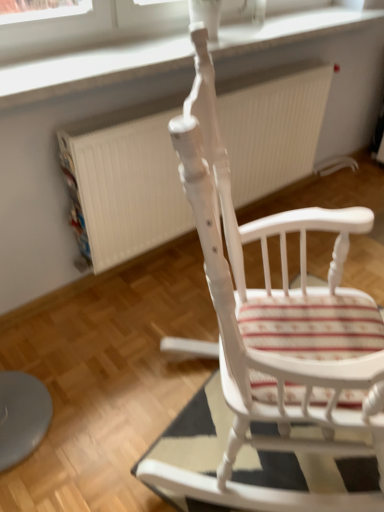
What is the approximate width of white plastic window frame at upper center?

It is 12.34 inches.

Locate an element on the screen. white plastic window frame at upper center is located at coordinates (90, 69).

Does white plastic window frame at upper center have a greater width compared to white textured radiator at center?

Indeed, white plastic window frame at upper center has a greater width compared to white textured radiator at center.

Which is less distant, (90,54) or (145,187)?

Point (90,54).

From the image's perspective, is white plastic window frame at upper center on top of white textured radiator at center?

Yes, from the image's perspective, white plastic window frame at upper center is over white textured radiator at center.

This screenshot has width=384, height=512. Find the location of `chair above the striped fabric mat at center (from a real-world perspective)`. chair above the striped fabric mat at center (from a real-world perspective) is located at coordinates (264, 298).

Is striped fabric mat at center taller or shorter than white painted wood rocking chair at center?

striped fabric mat at center is shorter than white painted wood rocking chair at center.

Which is more to the right, striped fabric mat at center or white painted wood rocking chair at center?

striped fabric mat at center.

Is striped fabric mat at center not close to white painted wood rocking chair at center?

No, striped fabric mat at center is in close proximity to white painted wood rocking chair at center.

Can we say white painted wood rocking chair at center lies outside striped fabric mat at center?

white painted wood rocking chair at center lies outside striped fabric mat at center's area.

From a real-world perspective, who is located lower, white painted wood rocking chair at center or striped fabric mat at center?

striped fabric mat at center is physically lower.

Which of these two, white painted wood rocking chair at center or striped fabric mat at center, stands shorter?

With less height is striped fabric mat at center.

Does point (197, 203) lie behind point (220, 409)?

No, (197, 203) is in front of (220, 409).

Relative to white painted wood rocking chair at center, is white textured radiator at center in front or behind?

In the image, white textured radiator at center appears behind white painted wood rocking chair at center.

In the image, there is a white painted wood rocking chair at center. Where is `radiator below it (from a real-world perspective)`? The width and height of the screenshot is (384, 512). radiator below it (from a real-world perspective) is located at coordinates (124, 184).

Is white painted wood rocking chair at center located within white textured radiator at center?

No, white textured radiator at center does not contain white painted wood rocking chair at center.

Which of these two, white textured radiator at center or white painted wood rocking chair at center, is smaller?

Smaller between the two is white textured radiator at center.

Between striped fabric mat at center and white plastic window frame at upper center, which one has larger width?

With larger width is striped fabric mat at center.

Is striped fabric mat at center aimed at white plastic window frame at upper center?

No, striped fabric mat at center is not oriented towards white plastic window frame at upper center.

Where is `window frame located behind the striped fabric mat at center`? This screenshot has height=512, width=384. window frame located behind the striped fabric mat at center is located at coordinates (90, 69).

From the image's perspective, between striped fabric mat at center and white textured radiator at center, who is located below?

From the image's view, striped fabric mat at center is below.

Which is closer to the camera, (204, 454) or (92, 248)?

Point (204, 454)

From the picture: How different are the orientations of striped fabric mat at center and white textured radiator at center in degrees?

The angular difference between striped fabric mat at center and white textured radiator at center is 16.9 degrees.

Are striped fabric mat at center and white textured radiator at center located far from each other?

They are positioned close to each other.

Based on the photo, can you confirm if white painted wood rocking chair at center is positioned to the right of white plastic window frame at upper center?

Indeed, white painted wood rocking chair at center is positioned on the right side of white plastic window frame at upper center.

Is white painted wood rocking chair at center taller than white plastic window frame at upper center?

Yes, white painted wood rocking chair at center is taller than white plastic window frame at upper center.

From a real-world perspective, who is located lower, white painted wood rocking chair at center or white plastic window frame at upper center?

In real-world perspective, white painted wood rocking chair at center is lower.

At what (x,y) coordinates should I click in order to perform the action: click on window frame to the right of white textured radiator at center. Please return your answer as a coordinate pair (x, y). This screenshot has height=512, width=384. Looking at the image, I should click on (90, 69).

At what (x,y) coordinates should I click in order to perform the action: click on chair lying above the striped fabric mat at center (from the image's perspective). Please return your answer as a coordinate pair (x, y). Looking at the image, I should click on [264, 298].

From the image, which object appears to be nearer to white painted wood rocking chair at center, striped fabric mat at center or white plastic window frame at upper center?

Among the two, striped fabric mat at center is located nearer to white painted wood rocking chair at center.

Looking at the image, which one is located closer to white painted wood rocking chair at center, white plastic window frame at upper center or striped fabric mat at center?

striped fabric mat at center is closer to white painted wood rocking chair at center.

Based on their spatial positions, is white plastic window frame at upper center or white textured radiator at center further from striped fabric mat at center?

The object further to striped fabric mat at center is white plastic window frame at upper center.

When comparing their distances from white plastic window frame at upper center, does striped fabric mat at center or white textured radiator at center seem closer?

Among the two, white textured radiator at center is located nearer to white plastic window frame at upper center.

Looking at the image, which one is located closer to striped fabric mat at center, white plastic window frame at upper center or white painted wood rocking chair at center?

white painted wood rocking chair at center.

Looking at this image, based on their spatial positions, is white painted wood rocking chair at center or white plastic window frame at upper center closer to white textured radiator at center?

white plastic window frame at upper center is closer to white textured radiator at center.

Which object lies nearer to the anchor point white painted wood rocking chair at center, striped fabric mat at center or white textured radiator at center?

Among the two, striped fabric mat at center is located nearer to white painted wood rocking chair at center.

Estimate the real-world distances between objects in this image. Which object is closer to white plastic window frame at upper center, white textured radiator at center or striped fabric mat at center?

Among the two, white textured radiator at center is located nearer to white plastic window frame at upper center.

This screenshot has width=384, height=512. I want to click on radiator between white plastic window frame at upper center and white painted wood rocking chair at center vertically, so click(124, 184).

This screenshot has height=512, width=384. What are the coordinates of `chair between white textured radiator at center and striped fabric mat at center from top to bottom` in the screenshot? It's located at (264, 298).

The height and width of the screenshot is (512, 384). I want to click on chair between white plastic window frame at upper center and striped fabric mat at center in the up-down direction, so click(264, 298).

Identify the location of radiator between white plastic window frame at upper center and striped fabric mat at center vertically. (124, 184).